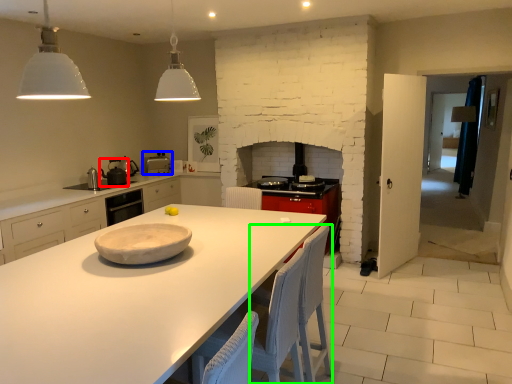
Question: Estimate the real-world distances between objects in this image. Which object is closer to appliance (highlighted by a red box), appliance (highlighted by a blue box) or chair (highlighted by a green box)?

Choices:
 (A) appliance
 (B) chair

Answer: (A)